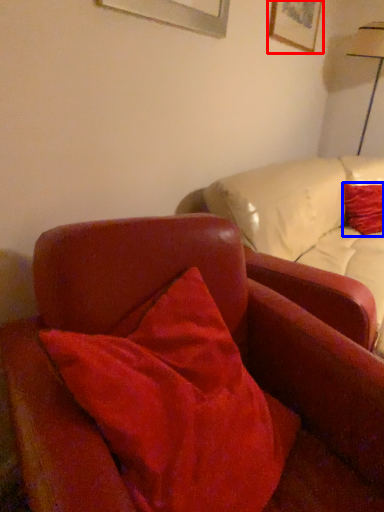
Question: Which point is closer to the camera, picture frame (highlighted by a red box) or pillow (highlighted by a blue box)?

Choices:
 (A) picture frame
 (B) pillow

Answer: (A)